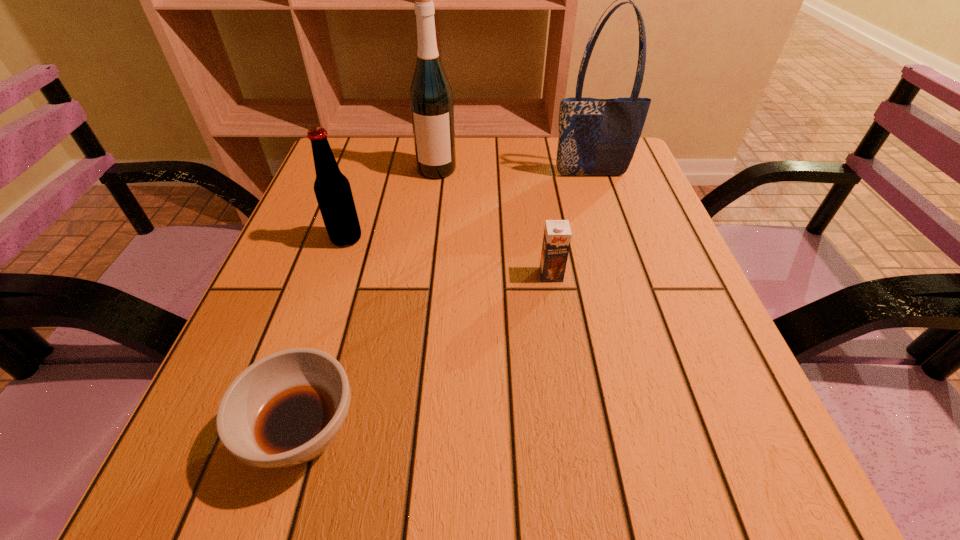
Where is `blank region between the third object from left to right and the third shortest object`? The height and width of the screenshot is (540, 960). blank region between the third object from left to right and the third shortest object is located at coordinates (392, 204).

Locate an element on the screen. free point between the wine bottle and the shortest object is located at coordinates (371, 301).

Identify the location of blank region between the wine bottle and the third farthest object. (392, 204).

Find the location of a particular element. This screenshot has height=540, width=960. empty space between the wine bottle and the third farthest object is located at coordinates (392, 204).

Identify the location of vacant area between the second shortest object and the nearest object. (428, 354).

Find the location of a particular element. This screenshot has height=540, width=960. vacant area that lies between the shopping bag and the second shortest object is located at coordinates (571, 225).

Locate an element on the screen. vacant space that's between the soup bowl and the fourth farthest object is located at coordinates (428, 354).

You are a GUI agent. You are given a task and a screenshot of the screen. Output one action in this format:
    pyautogui.click(x=<x>, y=<y>)
    Task: Click on the object that is the second closest to the rightmost object
    
    Given the screenshot: What is the action you would take?
    pyautogui.click(x=557, y=234)

Locate an element on the screen. object that is the closest to the wine bottle is located at coordinates (332, 189).